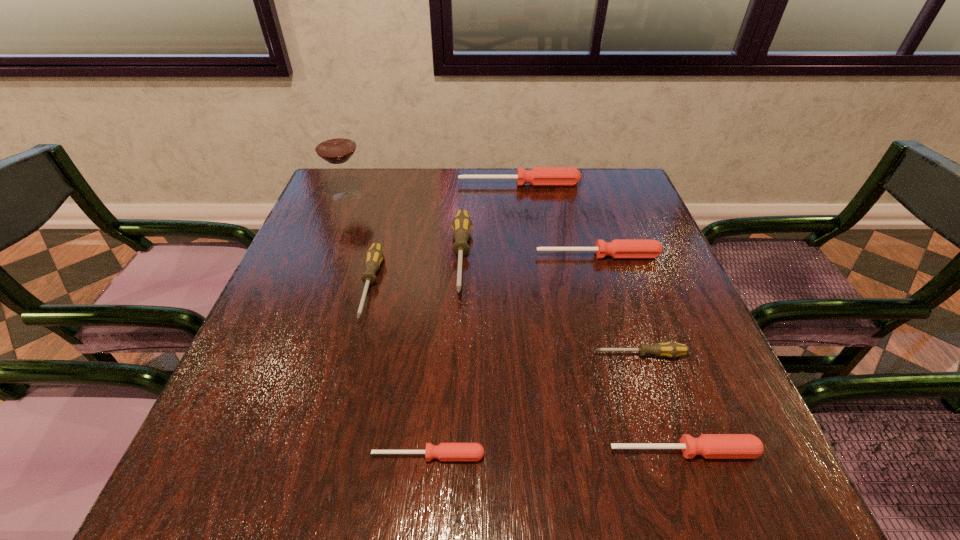
In the image, there is a desktop. Identify the location of vacant area at the near edge. (377, 491).

You are a GUI agent. You are given a task and a screenshot of the screen. Output one action in this format:
    pyautogui.click(x=<x>, y=<y>)
    Task: Click on the vacant region at the left edge of the desktop
    
    Given the screenshot: What is the action you would take?
    285,306

In the image, there is a desktop. Identify the location of vacant space at the right edge. (647, 226).

What are the coordinates of `vacant region at the far left corner of the desktop` in the screenshot? It's located at (357, 205).

The image size is (960, 540). I want to click on vacant space at the far right corner of the desktop, so click(x=620, y=175).

The width and height of the screenshot is (960, 540). What are the coordinates of `blank space at the near right corner of the desktop` in the screenshot? It's located at (675, 474).

Image resolution: width=960 pixels, height=540 pixels. What are the coordinates of `free space between the smallest red screwdriver and the nearest gray screwdriver` in the screenshot? It's located at (534, 405).

Image resolution: width=960 pixels, height=540 pixels. I want to click on vacant space that is in between the second gray screwdriver from right to left and the third biggest red screwdriver, so click(572, 354).

Find the location of a particular element. Image resolution: width=960 pixels, height=540 pixels. free space between the shortest object and the leftmost object is located at coordinates (388, 326).

This screenshot has width=960, height=540. I want to click on free space between the smallest red screwdriver and the biggest gray screwdriver, so click(x=444, y=356).